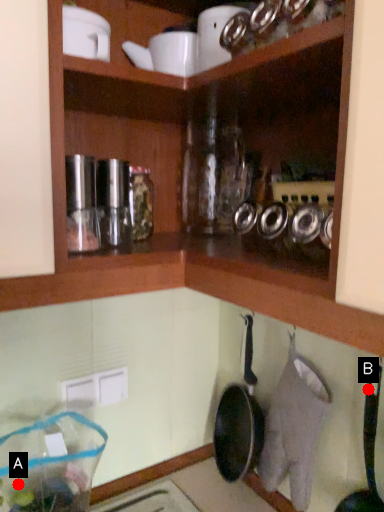
Question: Two points are circled on the image, labeled by A and B beside each circle. Which point is closer to the camera taking this photo?

Choices:
 (A) A is closer
 (B) B is closer

Answer: (B)